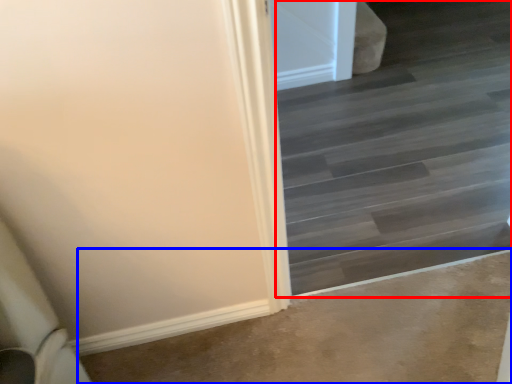
Question: Which of the following is the farthest to the observer, stairwell (highlighted by a red box) or concrete (highlighted by a blue box)?

Choices:
 (A) stairwell
 (B) concrete

Answer: (B)